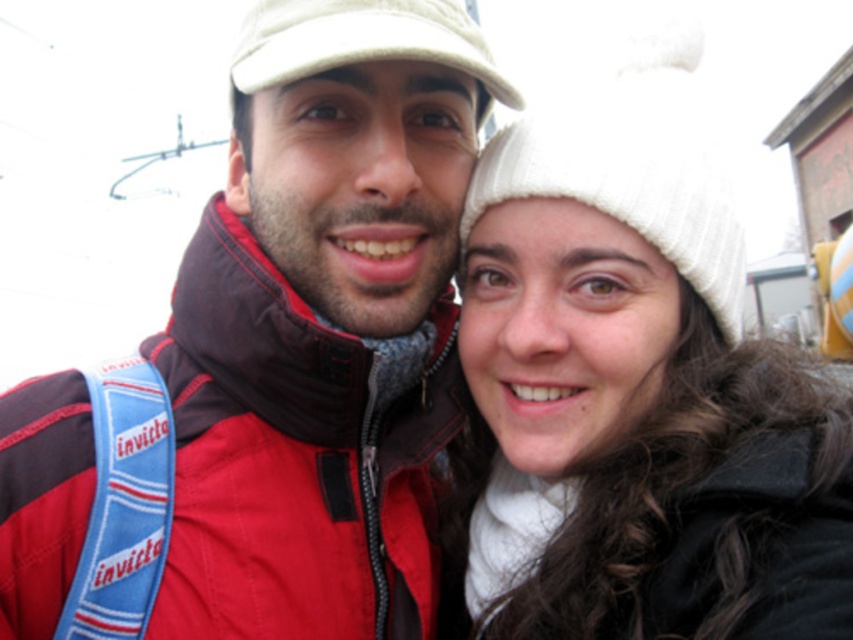
Question: Estimate the real-world distances between objects in this image. Which object is farther from the red matte jacket at center?

Choices:
 (A) white knit hat at upper right
 (B) white fabric cap at upper center

Answer: (B)

Question: Does white knit hat at upper right appear on the left side of white fabric cap at upper center?

Choices:
 (A) no
 (B) yes

Answer: (A)

Question: Is red matte jacket at center below white fabric cap at upper center?

Choices:
 (A) no
 (B) yes

Answer: (B)

Question: Which object is farther from the camera taking this photo?

Choices:
 (A) white knit hat at upper right
 (B) white fabric cap at upper center

Answer: (B)

Question: Which point is closer to the camera taking this photo?

Choices:
 (A) (695, 241)
 (B) (352, 52)

Answer: (B)

Question: Can you confirm if white knit hat at upper right is smaller than red matte jacket at center?

Choices:
 (A) no
 (B) yes

Answer: (A)